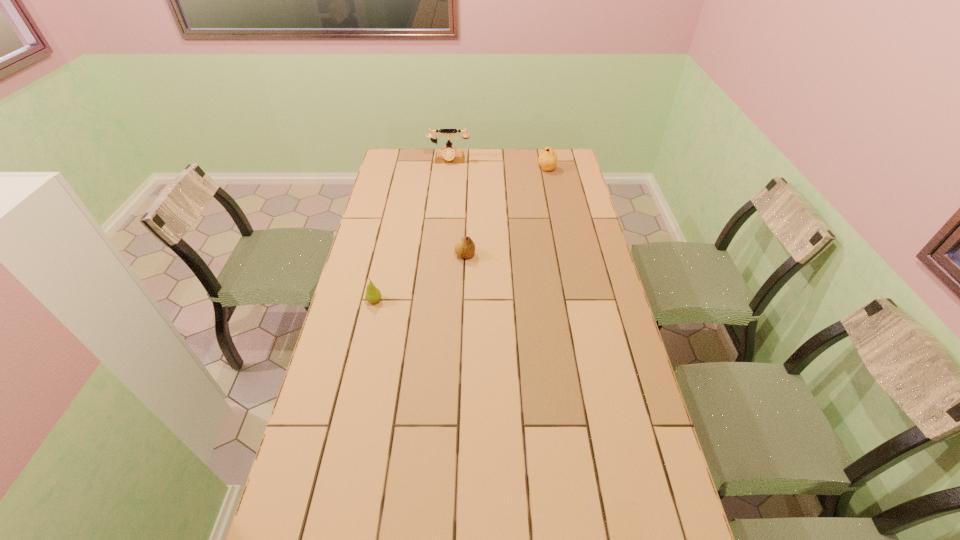
Where is `telephone`? This screenshot has height=540, width=960. telephone is located at coordinates (448, 155).

Locate an element on the screen. This screenshot has height=540, width=960. the rightmost pear is located at coordinates (547, 159).

The height and width of the screenshot is (540, 960). What are the coordinates of `the farthest pear` in the screenshot? It's located at (547, 159).

This screenshot has height=540, width=960. In order to click on the nearest object in this screenshot , I will do `click(373, 294)`.

The height and width of the screenshot is (540, 960). In order to click on the leftmost object in this screenshot , I will do `click(373, 294)`.

The height and width of the screenshot is (540, 960). I want to click on the second pear from left to right, so (x=464, y=247).

Where is `the second nearest pear`? the second nearest pear is located at coordinates (464, 247).

Image resolution: width=960 pixels, height=540 pixels. Find the location of `free region located on the dial of the telephone`. free region located on the dial of the telephone is located at coordinates (446, 184).

Identify the location of free space located on the front of the farthest pear. (556, 217).

This screenshot has width=960, height=540. Find the location of `blank space located 0.070m on the right of the leftmost pear`. blank space located 0.070m on the right of the leftmost pear is located at coordinates (403, 300).